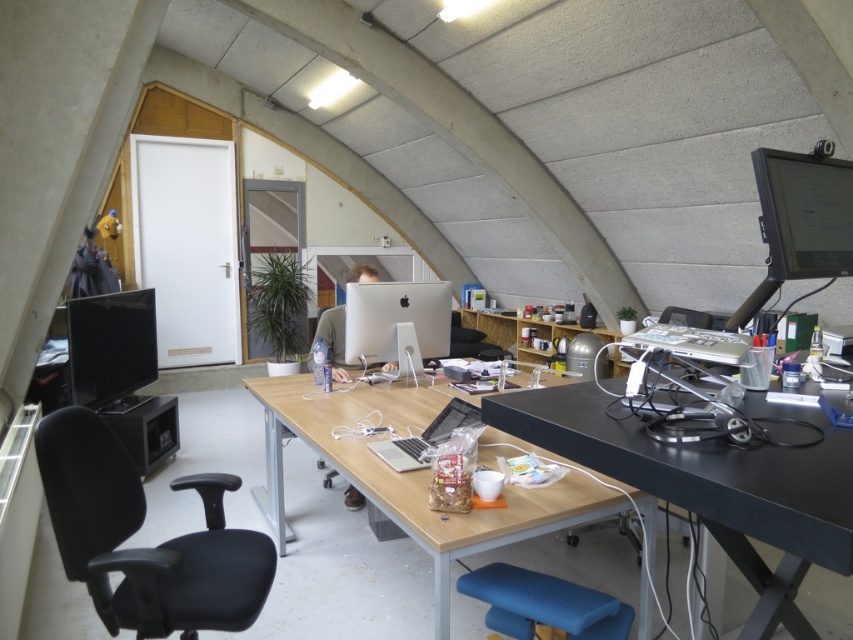
Between point (846, 192) and point (463, 584), which one is positioned behind?

The point (846, 192) is behind.

Which is more to the left, matte black monitor at upper right or blue fabric stool at lower center?

From the viewer's perspective, blue fabric stool at lower center appears more on the left side.

Is point (759, 168) more distant than point (556, 620)?

Yes, it is behind point (556, 620).

Find the location of a particular element. This screenshot has height=640, width=853. matte black monitor at upper right is located at coordinates (804, 212).

Does black matte table at right appear on the right side of wooden at center?

Indeed, black matte table at right is positioned on the right side of wooden at center.

Consider the image. Is black matte table at right behind wooden at center?

No, black matte table at right is closer to the viewer.

This screenshot has width=853, height=640. What do you see at coordinates (715, 483) in the screenshot?
I see `black matte table at right` at bounding box center [715, 483].

Identify the location of black matte table at right. (715, 483).

Who is taller, black matte table at right or satin black laptop at center?

black matte table at right

Which is in front, point (514, 428) or point (440, 429)?

Positioned in front is point (514, 428).

The height and width of the screenshot is (640, 853). I want to click on black matte table at right, so click(x=715, y=483).